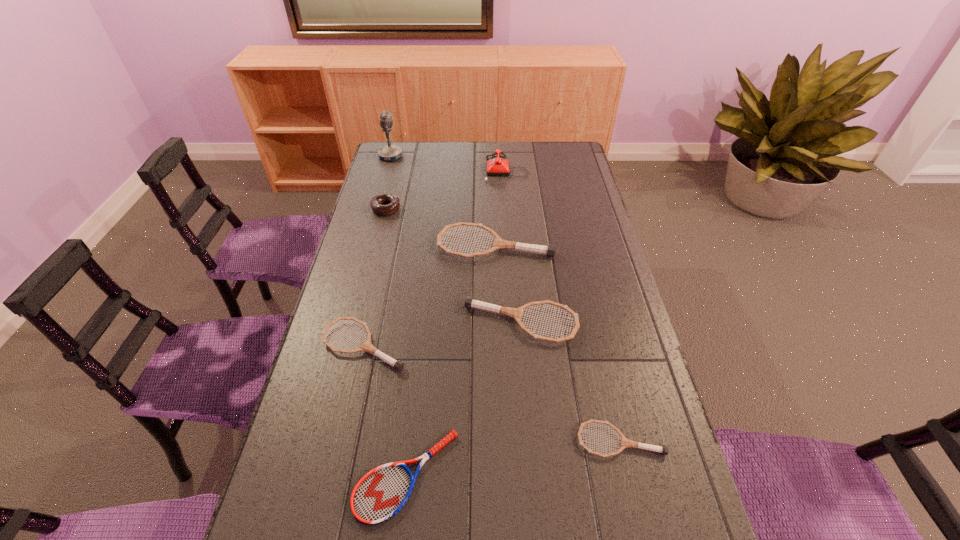
Where is `the seventh tallest object`? The width and height of the screenshot is (960, 540). the seventh tallest object is located at coordinates (625, 442).

Locate an element on the screen. the nearest gray tennis racket is located at coordinates (625, 442).

You are a GUI agent. You are given a task and a screenshot of the screen. Output one action in this format:
    pyautogui.click(x=<x>, y=<y>)
    Task: Click on the shortest object
    This screenshot has height=540, width=960.
    Given the screenshot: What is the action you would take?
    pyautogui.click(x=380, y=494)

You are a GUI agent. You are given a task and a screenshot of the screen. Output one action in this format:
    pyautogui.click(x=<x>, y=<y>)
    Task: Click on the blue tennis racket
    The image size is (960, 540).
    Given the screenshot: What is the action you would take?
    pyautogui.click(x=380, y=494)

The width and height of the screenshot is (960, 540). I want to click on vacant space located on the front-facing side of the microphone, so click(437, 157).

The image size is (960, 540). Identify the location of free space located 0.100m on the dial of the telephone. (461, 170).

The width and height of the screenshot is (960, 540). Find the location of `free space located 0.310m on the dial of the telephone`. free space located 0.310m on the dial of the telephone is located at coordinates (412, 170).

The height and width of the screenshot is (540, 960). I want to click on vacant area situated on the dial of the telephone, so point(391,170).

Identify the location of free space located on the left of the farthest tennis racket. The width and height of the screenshot is (960, 540). (403, 245).

At what (x,y) coordinates should I click in order to perform the action: click on vacant area situated on the back of the brown doughnut. Please return your answer as a coordinate pair (x, y). This screenshot has height=540, width=960. Looking at the image, I should click on (398, 157).